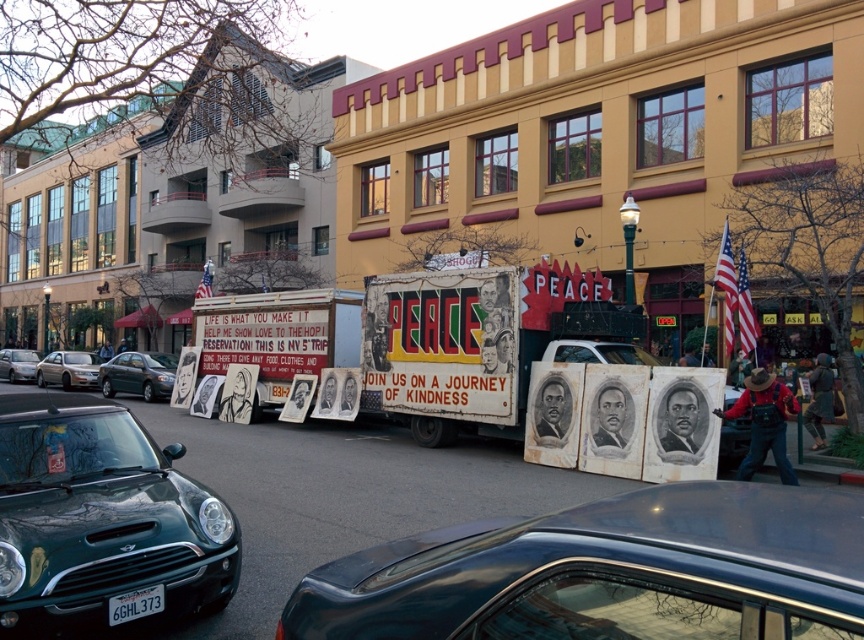
You are a delivery person needing to park your van between the metallic blue car at center and the green matte sedan at left. The van is 6 meters long. Can you fit it between them without moving either vehicle?

The metallic blue car at center and green matte sedan at left are 24.61 meters apart from each other. Since the van is only 6 meters long, there is sufficient space between the two cars to park the van without needing to move either vehicle.